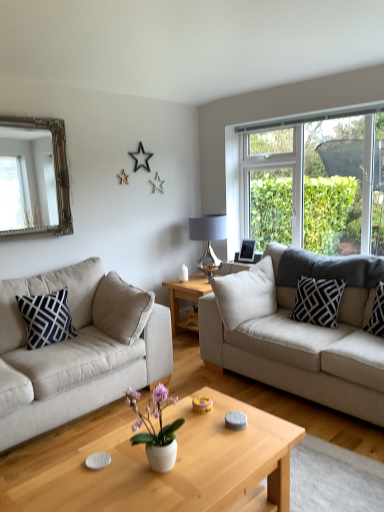
Question: Can you confirm if wooden coffee table at center, which is the first coffee table in back-to-front order, is positioned to the right of black and white patterned pillow at right, which appears as the second pillow when viewed from the left?

Choices:
 (A) yes
 (B) no

Answer: (B)

Question: Does wooden coffee table at center, positioned as the second coffee table in bottom-to-top order, have a larger size compared to black and white patterned pillow at right, the 2th pillow viewed from the right?

Choices:
 (A) no
 (B) yes

Answer: (B)

Question: Are wooden coffee table at center, arranged as the first coffee table when viewed from the top, and black and white patterned pillow at right, the 2th pillow viewed from the right, beside each other?

Choices:
 (A) yes
 (B) no

Answer: (B)

Question: Is wooden coffee table at center, positioned as the second coffee table in bottom-to-top order, shorter than black and white patterned pillow at right, the 2th pillow viewed from the right?

Choices:
 (A) no
 (B) yes

Answer: (A)

Question: Can you confirm if wooden coffee table at center, positioned as the second coffee table in bottom-to-top order, is wider than black and white patterned pillow at right, which appears as the second pillow when viewed from the left?

Choices:
 (A) no
 (B) yes

Answer: (B)

Question: From a real-world perspective, relative to light wood coffee table at center, which is the 2th coffee table in back-to-front order, is metallic silver lamp at center vertically above or below?

Choices:
 (A) below
 (B) above

Answer: (B)

Question: In terms of height, does metallic silver lamp at center look taller or shorter compared to light wood coffee table at center, which is the 2th coffee table in back-to-front order?

Choices:
 (A) tall
 (B) short

Answer: (A)

Question: Considering the positions of metallic silver lamp at center and light wood coffee table at center, acting as the 2th coffee table starting from the top, in the image, is metallic silver lamp at center wider or thinner than light wood coffee table at center, acting as the 2th coffee table starting from the top,?

Choices:
 (A) thin
 (B) wide

Answer: (A)

Question: From the image's perspective, is metallic silver lamp at center located above or below light wood coffee table at center, which is counted as the 1th coffee table, starting from the bottom?

Choices:
 (A) above
 (B) below

Answer: (A)

Question: In the image, is wooden coffee table at center, which is counted as the second coffee table, starting from the front, on the left side or the right side of silver/gilded mirror at upper left?

Choices:
 (A) left
 (B) right

Answer: (B)

Question: Is wooden coffee table at center, positioned as the second coffee table in bottom-to-top order, bigger or smaller than silver/gilded mirror at upper left?

Choices:
 (A) big
 (B) small

Answer: (A)

Question: From a real-world perspective, is wooden coffee table at center, positioned as the second coffee table in bottom-to-top order, above or below silver/gilded mirror at upper left?

Choices:
 (A) above
 (B) below

Answer: (B)

Question: In terms of width, does wooden coffee table at center, arranged as the first coffee table when viewed from the top, look wider or thinner when compared to silver/gilded mirror at upper left?

Choices:
 (A) thin
 (B) wide

Answer: (B)

Question: Looking at their shapes, would you say navy blue/white geometric pillow at left, the first pillow when ordered from left to right, is wider or thinner than silver/gilded mirror at upper left?

Choices:
 (A) wide
 (B) thin

Answer: (A)

Question: Is point (66, 289) closer or farther from the camera than point (72, 224)?

Choices:
 (A) farther
 (B) closer

Answer: (B)